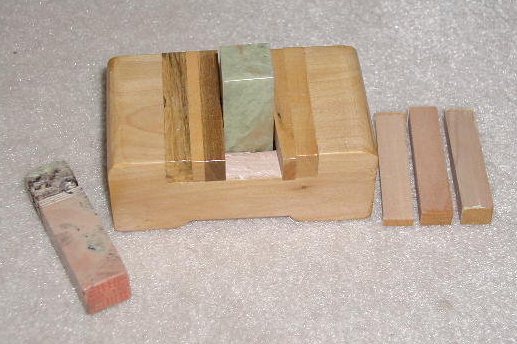
Locate an element on the screen. carpet under object is located at coordinates (285, 278).